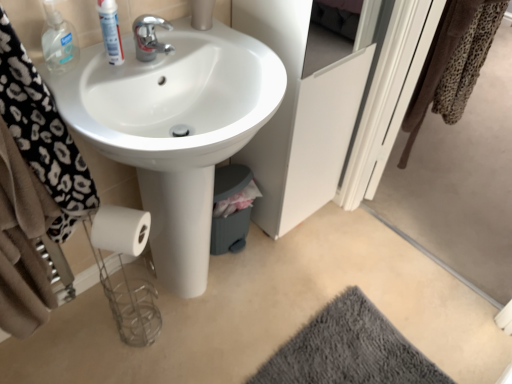
The image size is (512, 384). I want to click on vacant area that is situated to the right of gray fuzzy rug at lower right, so click(x=458, y=329).